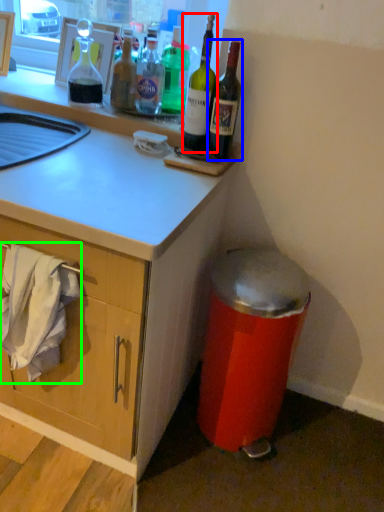
Question: Estimate the real-world distances between objects in this image. Which object is closer to bottle (highlighted by a red box), bottle (highlighted by a blue box) or laundry (highlighted by a green box)?

Choices:
 (A) bottle
 (B) laundry

Answer: (A)